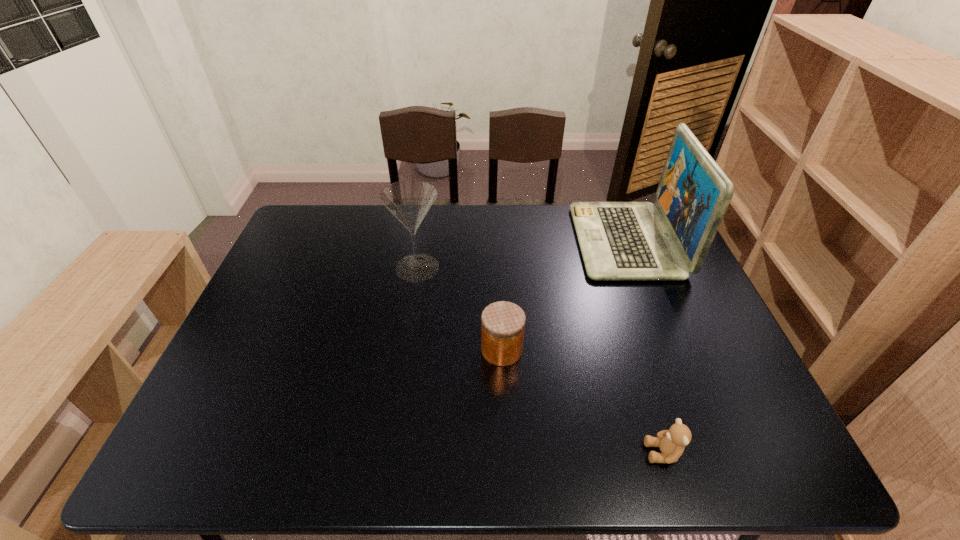
Where is `free area in between the teddy bear and the leftmost object`? Image resolution: width=960 pixels, height=540 pixels. free area in between the teddy bear and the leftmost object is located at coordinates (540, 360).

You are a GUI agent. You are given a task and a screenshot of the screen. Output one action in this format:
    pyautogui.click(x=<x>, y=<y>)
    Task: Click on the vacant space that is in between the leftmost object and the tallest object
    
    Given the screenshot: What is the action you would take?
    pyautogui.click(x=522, y=254)

I want to click on free point between the teddy bear and the second nearest object, so 583,401.

Choose which object is the third nearest neighbor to the shortest object. Please provide its 2D coordinates. Your answer should be formatted as a tuple, i.e. [(x, y)], where the tuple contains the x and y coordinates of a point satisfying the conditions above.

[(409, 201)]

Select which object is the closest to the third shortest object. Please provide its 2D coordinates. Your answer should be formatted as a tuple, i.e. [(x, y)], where the tuple contains the x and y coordinates of a point satisfying the conditions above.

[(503, 323)]

Locate an element on the screen. vacant position in the image that satisfies the following two spatial constraints: 1. on the front side of the flute glass; 2. on the right side of the jar is located at coordinates (405, 350).

Image resolution: width=960 pixels, height=540 pixels. What are the coordinates of `free spot that satisfies the following two spatial constraints: 1. on the screen of the tallest object; 2. on the front side of the leftmost object` in the screenshot? It's located at (636, 267).